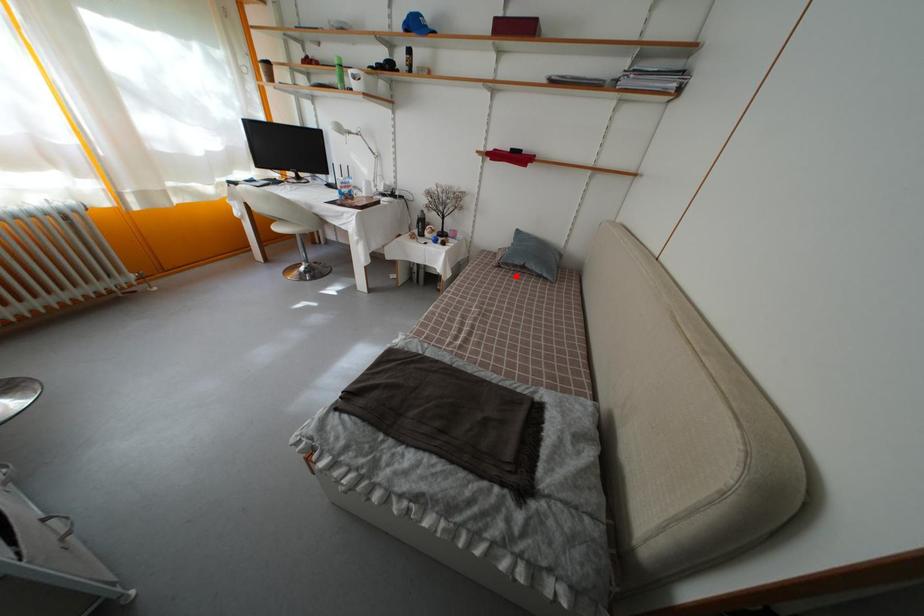
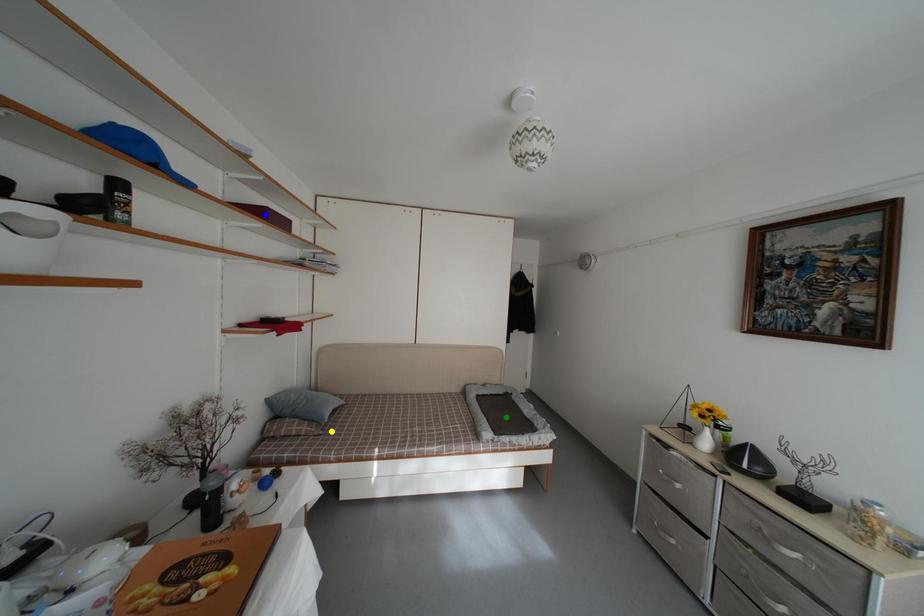
Question: I am providing you with two images of the same scene from different viewpoints. A red point is marked on the first image. You are given multiple points on the second image. In image 2, which mark is for the same physical point as the one in image 1?

Choices:
 (A) yellow point
 (B) blue point
 (C) green point

Answer: (A)